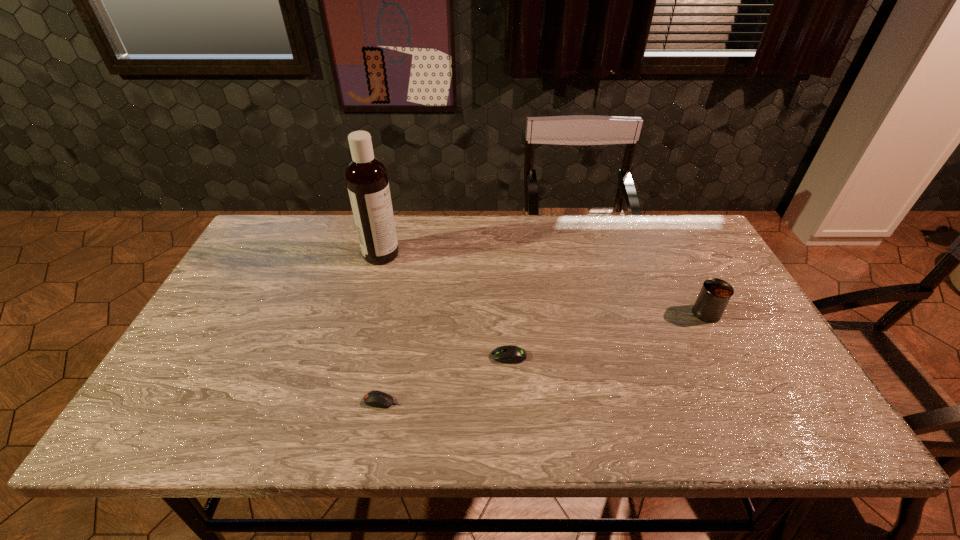
Find the location of `dishwasher detergent`. dishwasher detergent is located at coordinates (366, 177).

Locate an element on the screen. the farthest object is located at coordinates (366, 177).

Where is `the third nearest object`? Image resolution: width=960 pixels, height=540 pixels. the third nearest object is located at coordinates (715, 294).

This screenshot has width=960, height=540. Find the location of `the rightmost object`. the rightmost object is located at coordinates (715, 294).

Locate an element on the screen. Image resolution: width=960 pixels, height=540 pixels. the third object from left to right is located at coordinates (509, 354).

Find the location of a particular element. The image size is (960, 540). the farther computer mouse is located at coordinates tap(509, 354).

Image resolution: width=960 pixels, height=540 pixels. I want to click on the nearest object, so click(x=375, y=398).

Identify the location of the nearer computer mouse. (x=375, y=398).

At what (x,y) coordinates should I click in order to perform the action: click on vacant region located on the label side of the farthest object. Please return your answer as a coordinate pair (x, y). This screenshot has height=540, width=960. Looking at the image, I should click on click(467, 254).

The height and width of the screenshot is (540, 960). I want to click on vacant position located on the back of the second tallest object, so click(x=669, y=241).